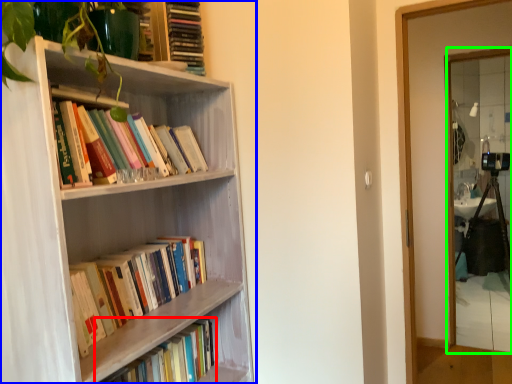
Question: Which object is positioned farthest from book (highlighted by a red box)? Select from bookcase (highlighted by a blue box) and mirror (highlighted by a green box).

Choices:
 (A) bookcase
 (B) mirror

Answer: (B)